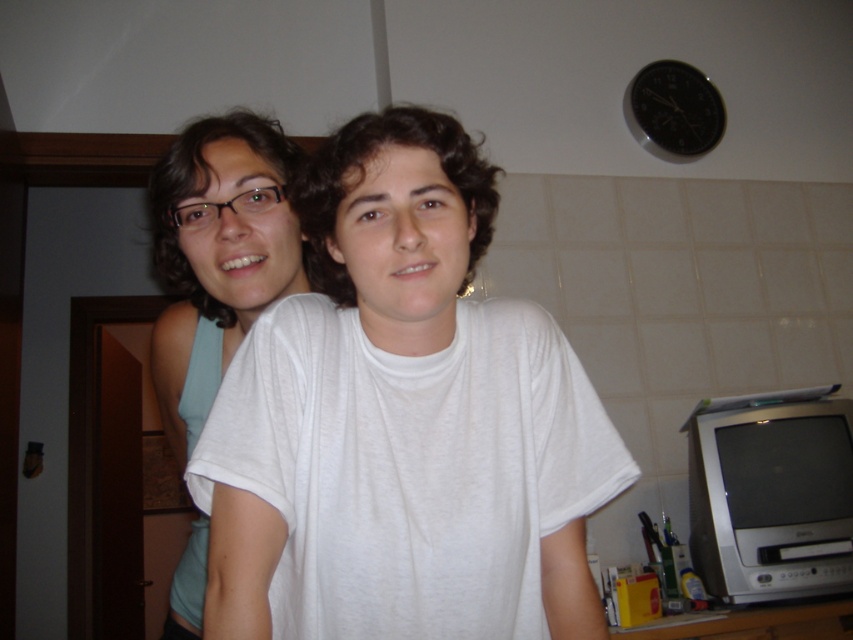
Question: Observing the image, what is the correct spatial positioning of white cotton shirt at center in reference to matte white t-shirt at left?

Choices:
 (A) below
 (B) above

Answer: (B)

Question: Which point is closer to the camera?

Choices:
 (A) white cotton shirt at center
 (B) matte white t-shirt at left

Answer: (A)

Question: Does white cotton shirt at center appear on the left side of matte white t-shirt at left?

Choices:
 (A) yes
 (B) no

Answer: (B)

Question: Among these objects, which one is nearest to the camera?

Choices:
 (A) matte white t-shirt at left
 (B) white cotton shirt at center

Answer: (B)

Question: Does white cotton shirt at center have a larger size compared to matte white t-shirt at left?

Choices:
 (A) no
 (B) yes

Answer: (A)

Question: Which point is farther to the camera?

Choices:
 (A) (476, 484)
 (B) (193, 378)

Answer: (B)